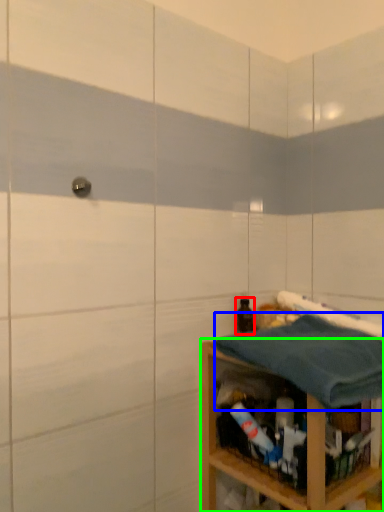
Question: Considering the real-world distances, which object is farthest from bottle (highlighted by a red box)? bath towel (highlighted by a blue box) or shelf (highlighted by a green box)?

Choices:
 (A) bath towel
 (B) shelf

Answer: (B)